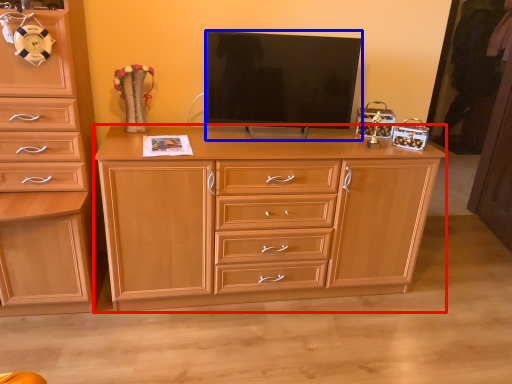
Question: Which point is further to the camera, chest of drawers (highlighted by a red box) or television (highlighted by a blue box)?

Choices:
 (A) chest of drawers
 (B) television

Answer: (B)